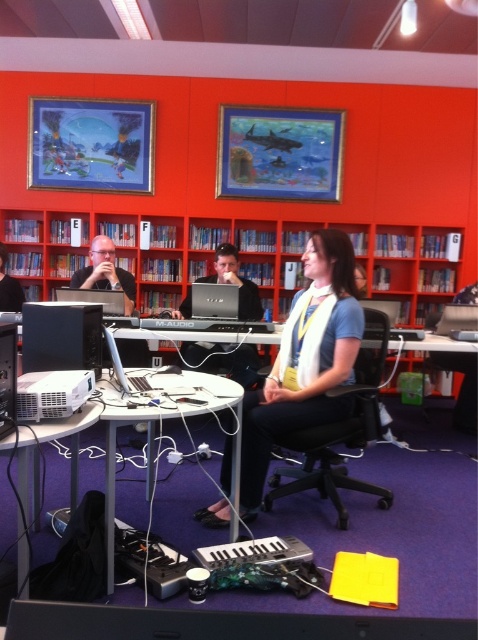
Question: Which is nearer to the matte black laptop at center?

Choices:
 (A) matte black laptop at left
 (B) black plastic table at lower left
 (C) silver/black laptop at center
 (D) matte blue shirt at center

Answer: (C)

Question: Is matte blue shirt at center below white plastic table at center?

Choices:
 (A) yes
 (B) no

Answer: (B)

Question: Can you confirm if red plastic bookcase at center is wider than matte black laptop at left?

Choices:
 (A) no
 (B) yes

Answer: (B)

Question: Which point is farther from the camera taking this photo?

Choices:
 (A) (232, 353)
 (B) (314, 244)

Answer: (A)

Question: Based on their relative distances, which object is farther from the white plastic table at center?

Choices:
 (A) black plastic monitor at lower center
 (B) matte black laptop at center
 (C) black plastic table at lower left

Answer: (B)

Question: Does matte blue shirt at center have a greater width compared to matte black laptop at center?

Choices:
 (A) no
 (B) yes

Answer: (B)